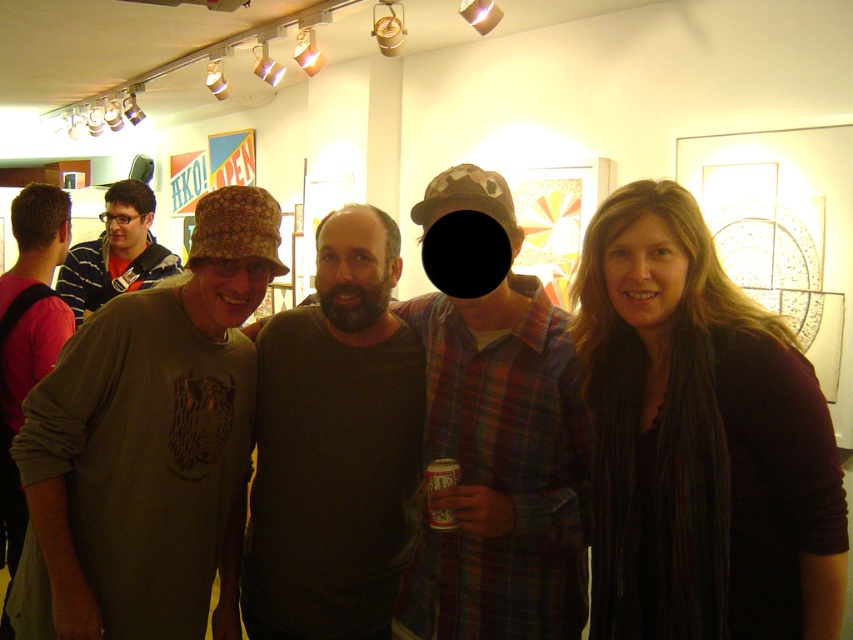
Between dark brown scarf at center and metallic silver can at center, which one has less height?

metallic silver can at center is shorter.

Looking at this image, which is below, dark brown scarf at center or metallic silver can at center?

Positioned lower is metallic silver can at center.

Locate an element on the screen. dark brown scarf at center is located at coordinates (697, 436).

Locate an element on the screen. Image resolution: width=853 pixels, height=640 pixels. plaid fabric shirt at center is located at coordinates (494, 432).

This screenshot has height=640, width=853. In order to click on plaid fabric shirt at center in this screenshot , I will do `click(494, 432)`.

Can you confirm if matte green t-shirt at center is positioned to the right of camouflage-patterned hat at left?

Indeed, matte green t-shirt at center is positioned on the right side of camouflage-patterned hat at left.

Is point (241, 282) farther from viewer compared to point (129, 273)?

That is False.

Between point (99, 604) and point (144, 285), which one is positioned in front?

Positioned in front is point (99, 604).

This screenshot has height=640, width=853. I want to click on matte green t-shirt at center, so click(x=149, y=445).